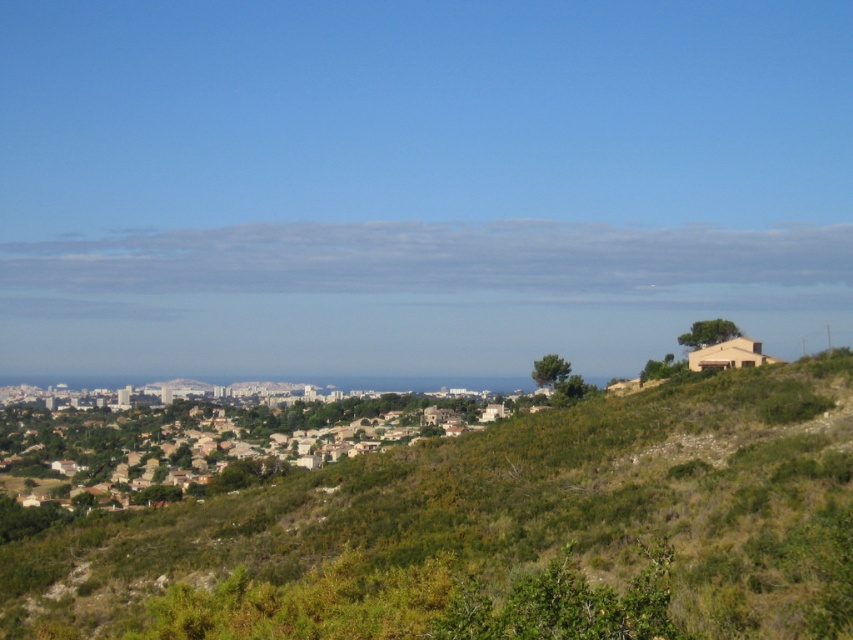
You are planning to install a new garden in the coastal town. You have two options for the location of the garden. One is near the green shrubbery at center, and the other is near the beige matte house at right. Which location has more space available for the garden?

The green shrubbery at center is wider than the beige matte house at right, so the area near the green shrubbery at center has more space available for the garden.

You are a tourist standing at the center of the coastal town and want to take a photo of both the brown stone houses at lower left and the beige matte house at right. Which direction should you face to ensure both are visible in your camera frame?

The brown stone houses at lower left are positioned on the left side of beige matte house at right, so facing towards the beige matte house at right while keeping the brown stone houses at lower left in the left side of the frame would capture both.